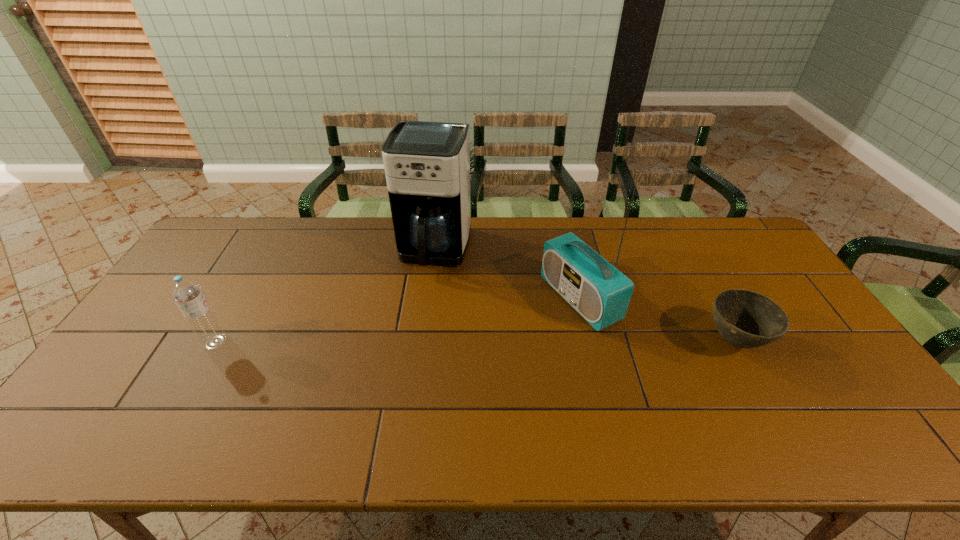
Identify the location of blank area in the image that satisfies the following two spatial constraints: 1. on the back side of the leftmost object; 2. on the left side of the third object from left to right. The image size is (960, 540). (240, 299).